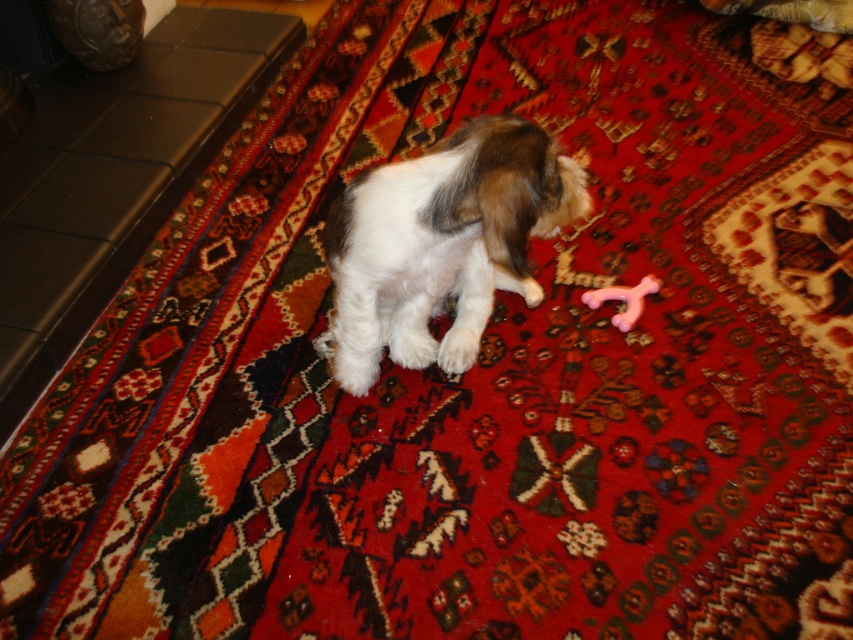
Question: Can you confirm if white fluffy dog at center is thinner than pink rubber toy at center?

Choices:
 (A) no
 (B) yes

Answer: (A)

Question: Is white fluffy dog at center further to the viewer compared to pink rubber toy at center?

Choices:
 (A) yes
 (B) no

Answer: (B)

Question: Which point is farther to the camera?

Choices:
 (A) (381, 211)
 (B) (624, 292)

Answer: (B)

Question: Among these points, which one is nearest to the camera?

Choices:
 (A) (618, 291)
 (B) (471, 356)

Answer: (B)

Question: Is white fluffy dog at center below pink rubber toy at center?

Choices:
 (A) yes
 (B) no

Answer: (B)